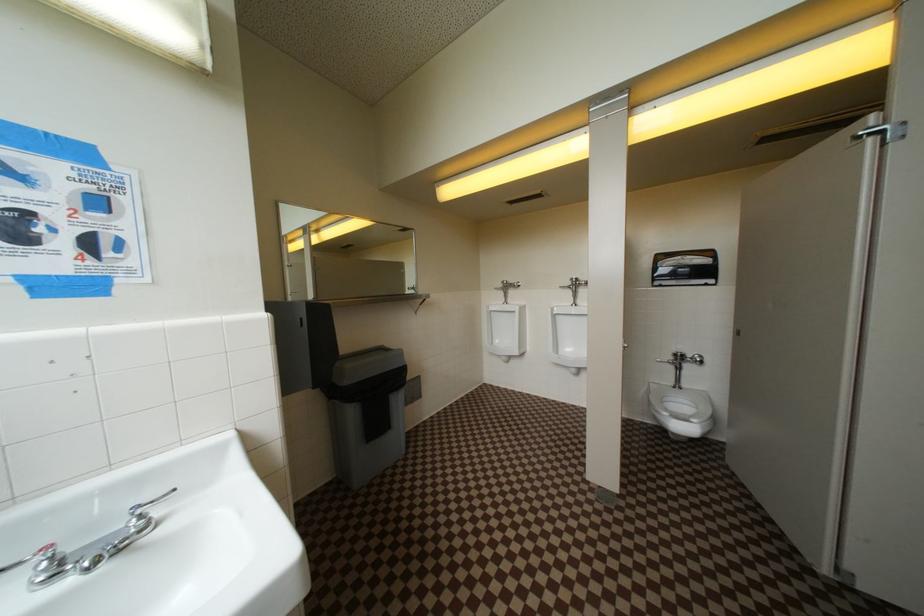
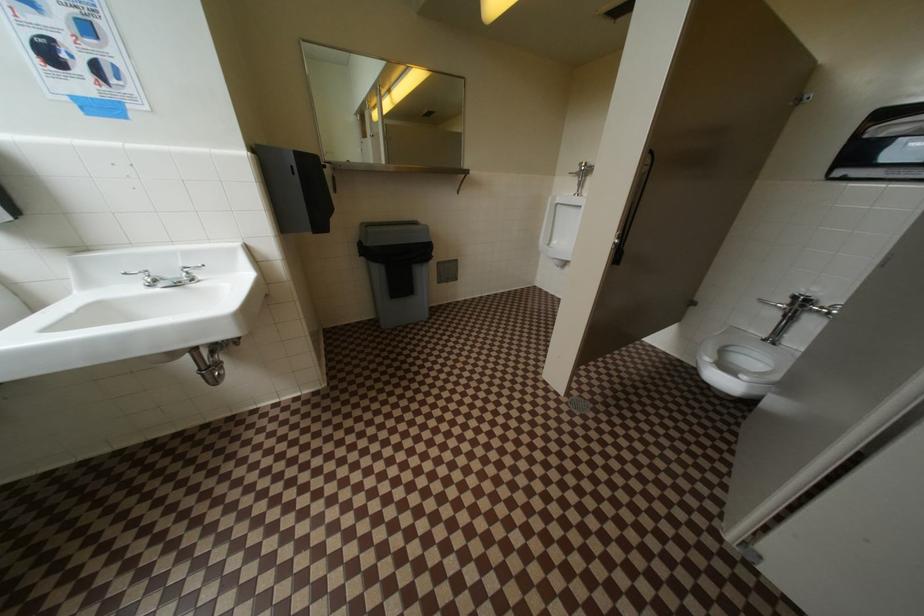
Based on the continuous images, in which direction is the camera rotating?

The camera's rotation is toward left-down.